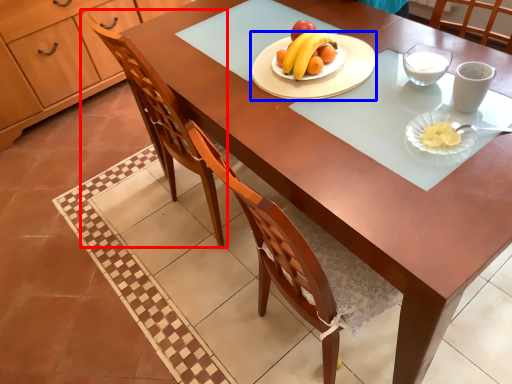
Question: Which of the following is the closest to the observer, chair (highlighted by a red box) or platter (highlighted by a blue box)?

Choices:
 (A) chair
 (B) platter

Answer: (A)